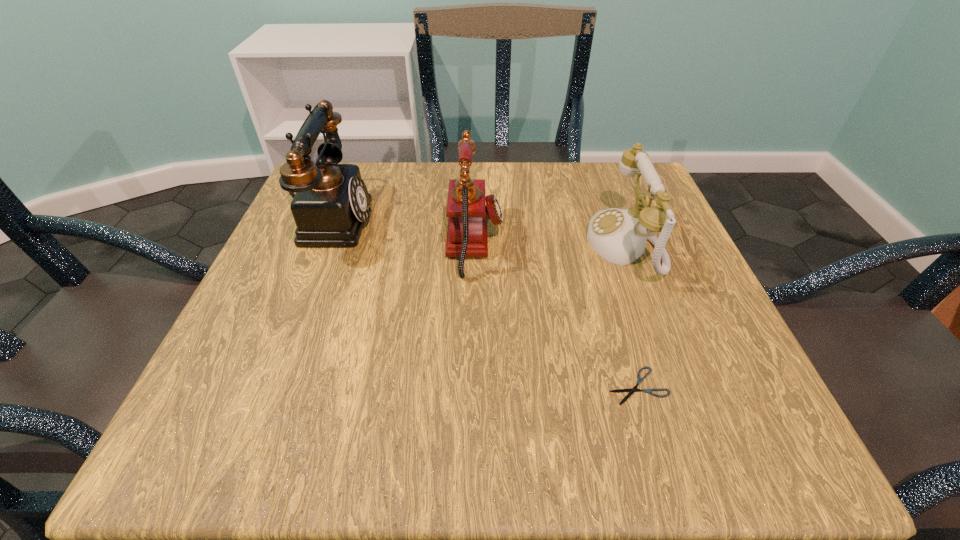
Where is `the leftmost telephone`? the leftmost telephone is located at coordinates (330, 207).

The width and height of the screenshot is (960, 540). In order to click on the tallest telephone in this screenshot , I will do `click(330, 207)`.

Find the location of `the second telephone from right to left`. the second telephone from right to left is located at coordinates (467, 236).

What are the coordinates of `the rightmost telephone` in the screenshot? It's located at (619, 236).

I want to click on the nearest object, so click(x=639, y=380).

Find the location of `shears`. shears is located at coordinates (639, 380).

Locate an element on the screen. This screenshot has width=960, height=540. free space located on the front of the tallest telephone at the rotary dial is located at coordinates (484, 219).

Where is `vacant area situated 0.110m on the dial of the second object from left to right`? The width and height of the screenshot is (960, 540). vacant area situated 0.110m on the dial of the second object from left to right is located at coordinates (560, 242).

In order to click on free space located 0.210m on the dial of the rightmost telephone in this screenshot , I will do (479, 244).

At what (x,y) coordinates should I click in order to perform the action: click on vacant space located 0.100m on the dial of the rightmost telephone. Please return your answer as a coordinate pair (x, y). This screenshot has width=960, height=540. Looking at the image, I should click on (536, 244).